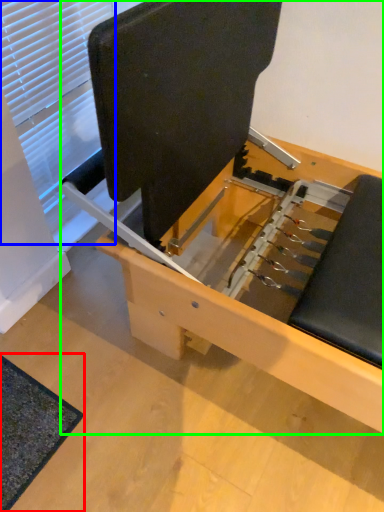
Question: Which object is positioned closest to mat (highlighted by a red box)? Select from window (highlighted by a blue box) and furniture (highlighted by a green box).

Choices:
 (A) window
 (B) furniture

Answer: (B)